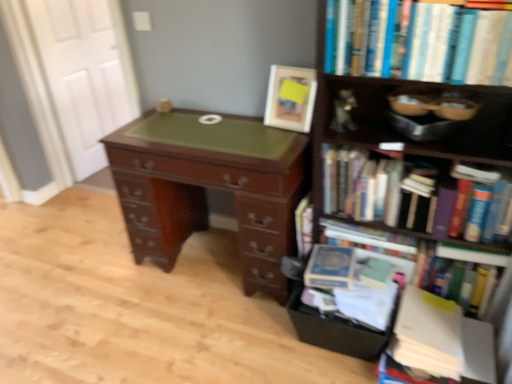
Question: From the image's perspective, does wooden bookcase at right appear lower than hardcover books at upper right, which appears as the 5th book when ordered from the bottom?

Choices:
 (A) no
 (B) yes

Answer: (B)

Question: Is wooden bookcase at right positioned with its back to hardcover books at upper right, which appears as the 5th book when ordered from the bottom?

Choices:
 (A) no
 (B) yes

Answer: (B)

Question: Is wooden bookcase at right to the left of hardcover books at upper right, which appears as the 1th book when viewed from the top, from the viewer's perspective?

Choices:
 (A) yes
 (B) no

Answer: (B)

Question: From a real-world perspective, is wooden bookcase at right under hardcover books at upper right, which appears as the 5th book when ordered from the bottom?

Choices:
 (A) no
 (B) yes

Answer: (B)

Question: Is wooden bookcase at right in front of hardcover books at upper right, which appears as the 1th book when viewed from the top?

Choices:
 (A) yes
 (B) no

Answer: (A)

Question: Considering the relative sizes of wooden bookcase at right and hardcover books at upper right, which appears as the 5th book when ordered from the bottom, in the image provided, is wooden bookcase at right taller than hardcover books at upper right, which appears as the 5th book when ordered from the bottom,?

Choices:
 (A) yes
 (B) no

Answer: (A)

Question: Can you confirm if white wood door at upper left is shorter than black cardboard drawer at lower right?

Choices:
 (A) no
 (B) yes

Answer: (A)

Question: Does white wood door at upper left have a greater height compared to black cardboard drawer at lower right?

Choices:
 (A) yes
 (B) no

Answer: (A)

Question: Is white wood door at upper left oriented towards black cardboard drawer at lower right?

Choices:
 (A) yes
 (B) no

Answer: (A)

Question: Would you say white wood door at upper left is a long distance from black cardboard drawer at lower right?

Choices:
 (A) yes
 (B) no

Answer: (A)

Question: Is white wood door at upper left behind black cardboard drawer at lower right?

Choices:
 (A) yes
 (B) no

Answer: (A)

Question: Is white wood door at upper left in contact with black cardboard drawer at lower right?

Choices:
 (A) yes
 (B) no

Answer: (B)

Question: Is white paper stack at lower right, which appears as the 1th book when ordered from the bottom, outside of white wood door at upper left?

Choices:
 (A) no
 (B) yes

Answer: (B)